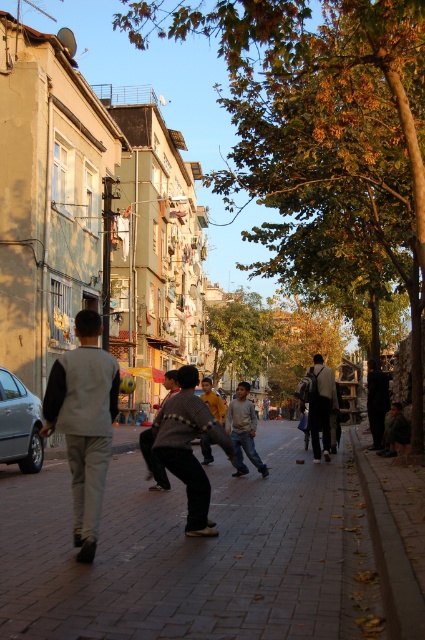
Can you confirm if brick pavement at center is positioned to the left of light gray vest at center?

Incorrect, brick pavement at center is not on the left side of light gray vest at center.

Based on the photo, can you confirm if brick pavement at center is smaller than light gray vest at center?

No, brick pavement at center is not smaller than light gray vest at center.

Between point (283, 458) and point (64, 385), which one is positioned behind?

Point (283, 458)

This screenshot has width=425, height=640. Identify the location of brick pavement at center. (178, 554).